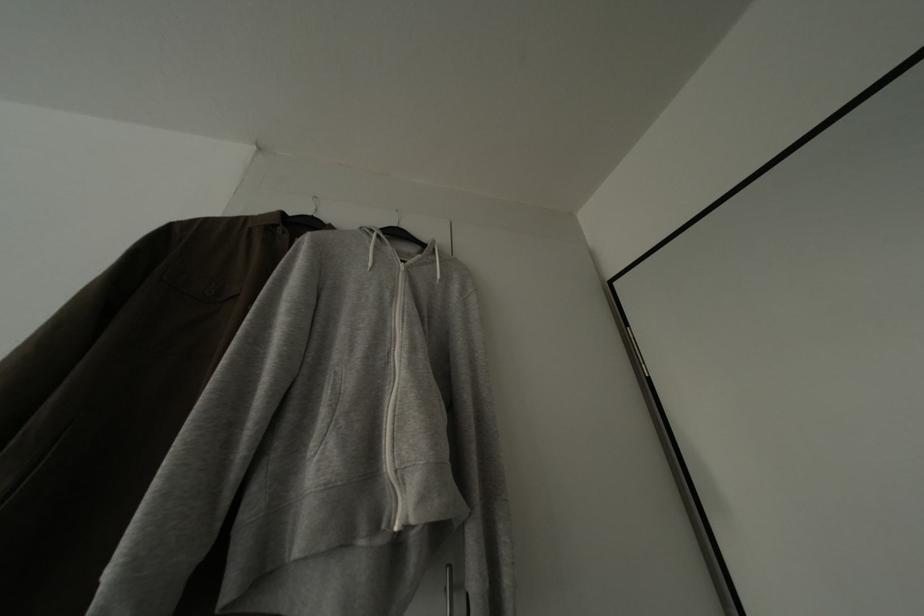
Find where to pull the white hood drawstring. Please return your answer as a coordinate pair (x, y).

(434, 256)